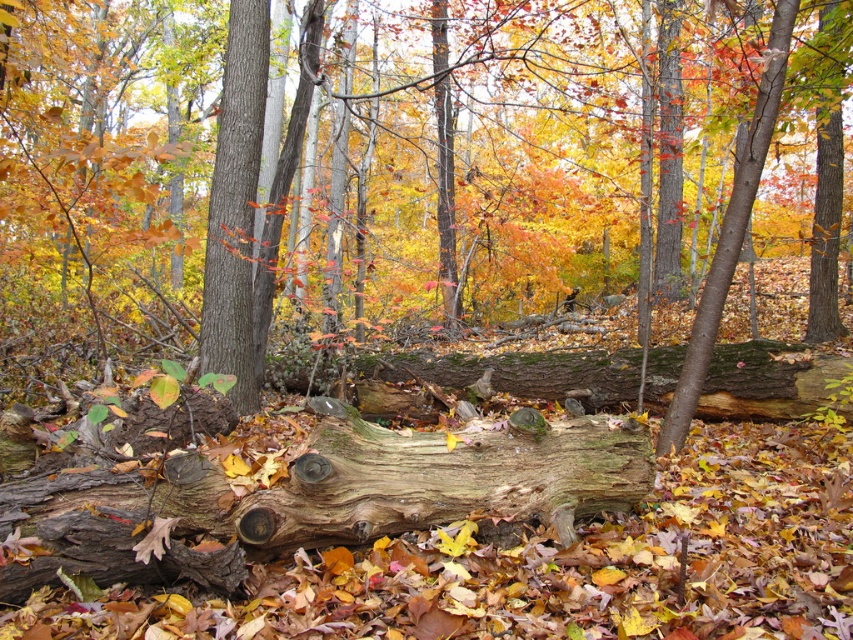
You are standing in the autumn forest scene described. You need to place a small decorative stone exactly at the center of the image. Is the weathered wood log at center located to the left or right of where you should place the stone?

The weathered wood log at center is located at point 2D coordinates of (317, 497). The center of the image is at (426, 320). Since 0.778 is greater than 0.5 on the x axis, the log is to the right of the center point where the stone should be placed.

Based on the photo, you are a hiker who needs to cross a stream that flows between the weathered wood log at center and the smooth brown tree trunk at center. The stream is 3 meters wide. Can you safely cross the stream by stepping on the two objects?

The distance between the weathered wood log at center and the smooth brown tree trunk at center is 3.26 meters. Since the stream is 3 meters wide, the hiker can safely cross by stepping on both objects as the distance between them is slightly wider than the stream.